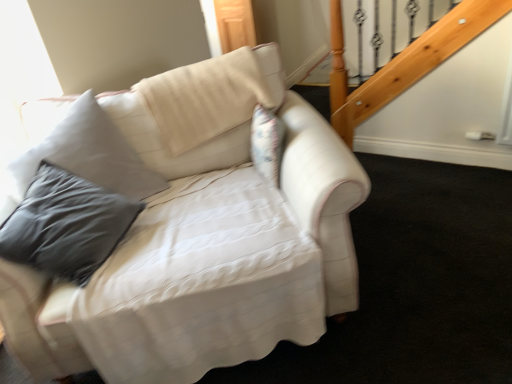
Image resolution: width=512 pixels, height=384 pixels. I want to click on spots to the right of white fabric couch at center, so click(x=432, y=246).